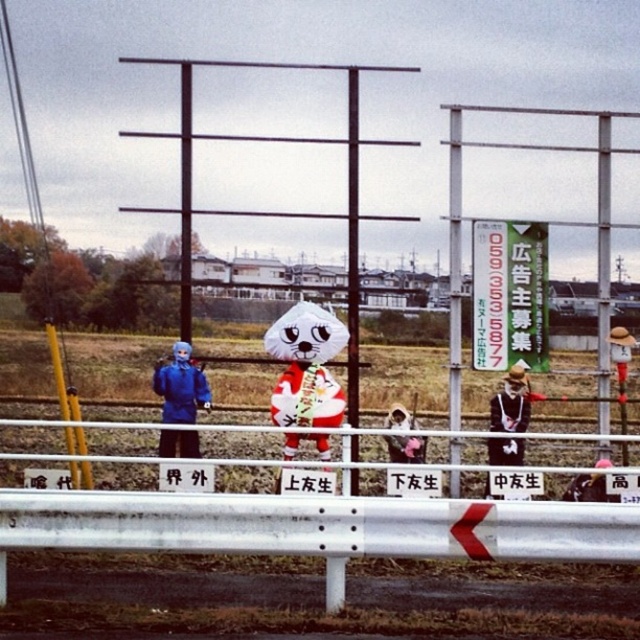
You are a photographer trying to capture a clear shot of the black leather jacket at center and the matte black helmet at lower right. Which object will appear closer to you in the photo?

The black leather jacket at center will appear closer to you in the photo because it is positioned closer to the viewer compared to the matte black helmet at lower right.

You are a visitor at an event and want to take a photo of the matte black helmet at lower right without the white metal pole at center blocking the view. Is this possible based on the scene description?

The matte black helmet at lower right is behind the white metal pole at center, so it is already blocked by the pole. Therefore, you cannot take a photo of the matte black helmet at lower right without the white metal pole at center blocking the view.

You are trying to decide which costume to choose for a parade. You see a blue fabric person at left and a black leather jacket at center. Which costume is bigger?

The blue fabric person at left is larger in size than the black leather jacket at center, so the blue fabric person at left is the bigger costume.